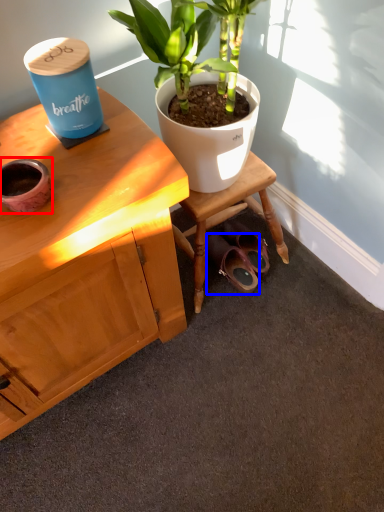
Question: Among these objects, which one is nearest to the camera, flowerpot (highlighted by a red box) or footwear (highlighted by a blue box)?

Choices:
 (A) flowerpot
 (B) footwear

Answer: (A)